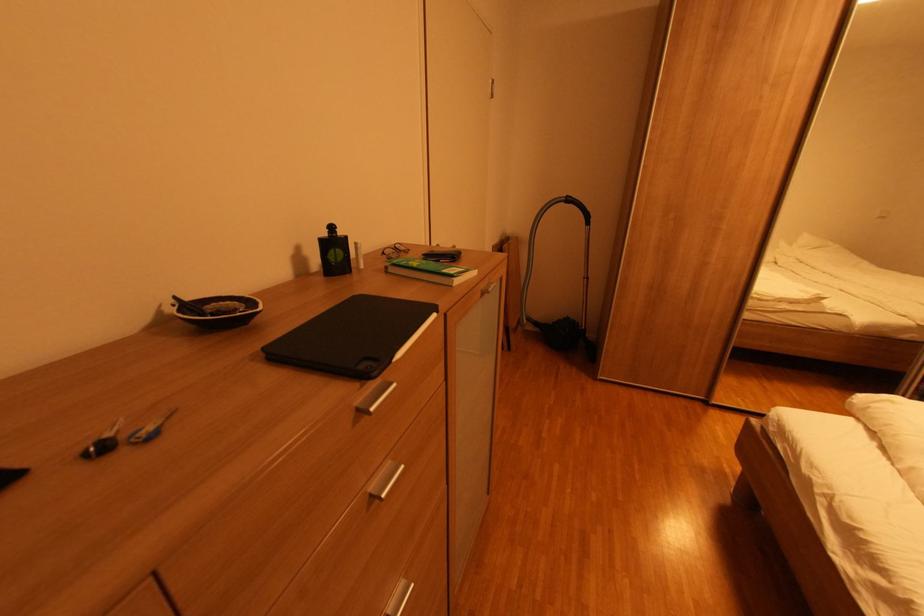
Locate an element on the screen. The image size is (924, 616). black tablet case is located at coordinates (353, 336).